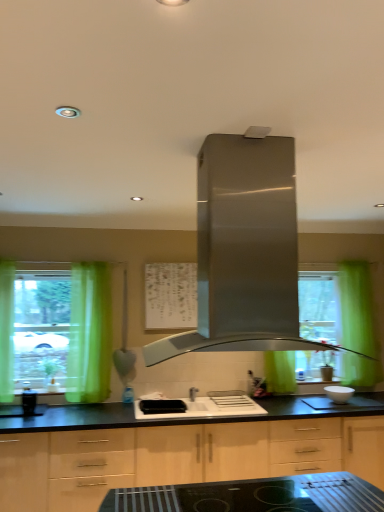
Question: Based on their positions, is light wood cabinet at center located to the left or right of stainless steel range hood at center?

Choices:
 (A) left
 (B) right

Answer: (A)

Question: From a real-world perspective, is light wood cabinet at center above or below stainless steel range hood at center?

Choices:
 (A) below
 (B) above

Answer: (A)

Question: Based on their relative distances, which object is farther from the stainless steel range hood at center?

Choices:
 (A) white glossy sink at center
 (B) black glossy coffee maker at left
 (C) green fabric curtain at left
 (D) transparent glass window at left
 (E) light wood cabinet at center

Answer: (B)

Question: Which is nearer to the white matte bowl at lower right?

Choices:
 (A) transparent glass window at left
 (B) black glossy coffee maker at left
 (C) stainless steel range hood at center
 (D) white glossy sink at center
 (E) light wood cabinet at center

Answer: (D)